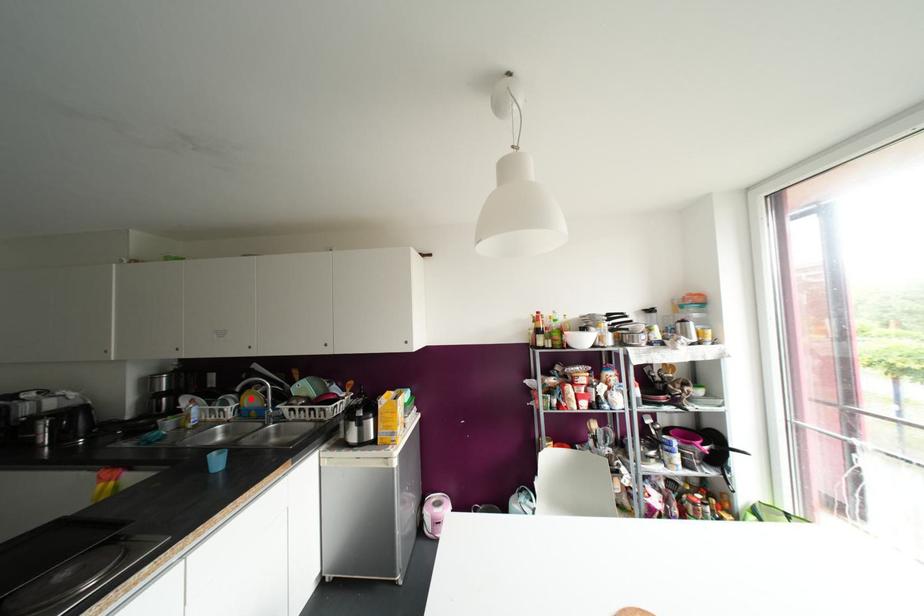
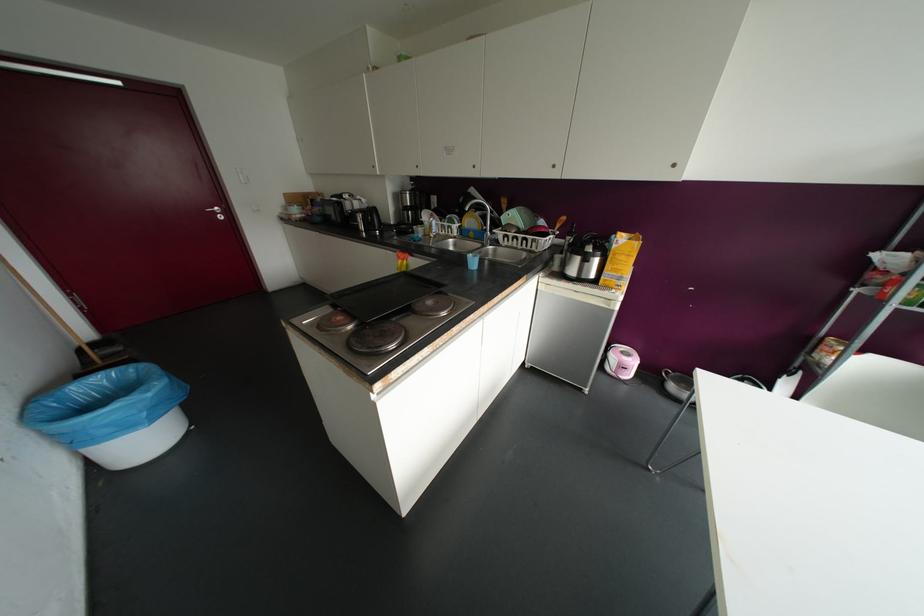
Question: A red point is marked in image1. In image2, is the corresponding 3D point closer to the camera or farther? Reply with the corresponding letter.

Choices:
 (A) The corresponding 3D point is closer.
 (B) The corresponding 3D point is farther.

Answer: (A)